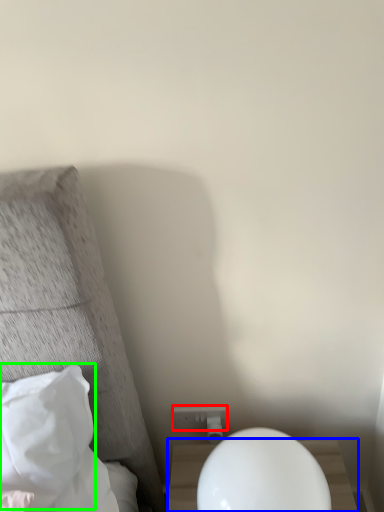
Question: Estimate the real-world distances between objects in this image. Which object is farther from electric outlet (highlighted by a red box), nightstand (highlighted by a blue box) or pillow (highlighted by a green box)?

Choices:
 (A) nightstand
 (B) pillow

Answer: (B)